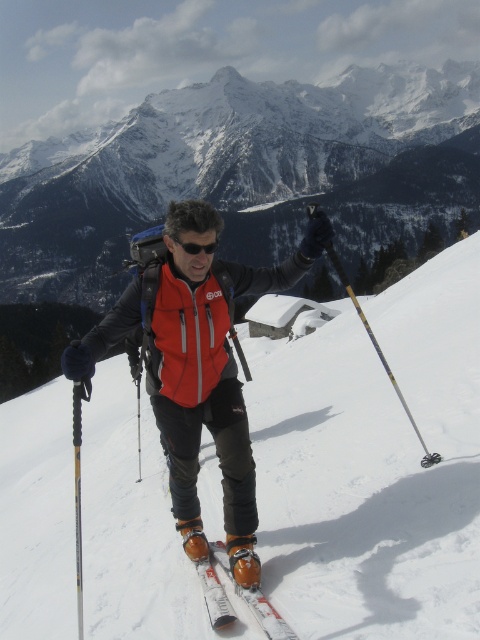
Question: Can you confirm if yellow and black ski pole at center is thinner than black plastic goggles at center?

Choices:
 (A) no
 (B) yes

Answer: (A)

Question: Which point appears farthest from the camera in this image?

Choices:
 (A) (394, 378)
 (B) (475, 616)
 (C) (222, 616)
 (D) (201, 552)

Answer: (A)

Question: Which point is closer to the camera?

Choices:
 (A) (351, 152)
 (B) (243, 403)
 (C) (272, 632)
 (D) (200, 250)

Answer: (C)

Question: Which object is the closest to the yellow and black ski pole at center?

Choices:
 (A) orange softshell jacket at center
 (B) black plastic goggles at center
 (C) white snow ski slope at center
 (D) white metallic skis at center

Answer: (A)

Question: Can you confirm if white snow ski slope at center is wider than yellow and black ski pole at center?

Choices:
 (A) no
 (B) yes

Answer: (B)

Question: Is yellow and black ski pole at center in front of black plastic goggles at center?

Choices:
 (A) no
 (B) yes

Answer: (A)